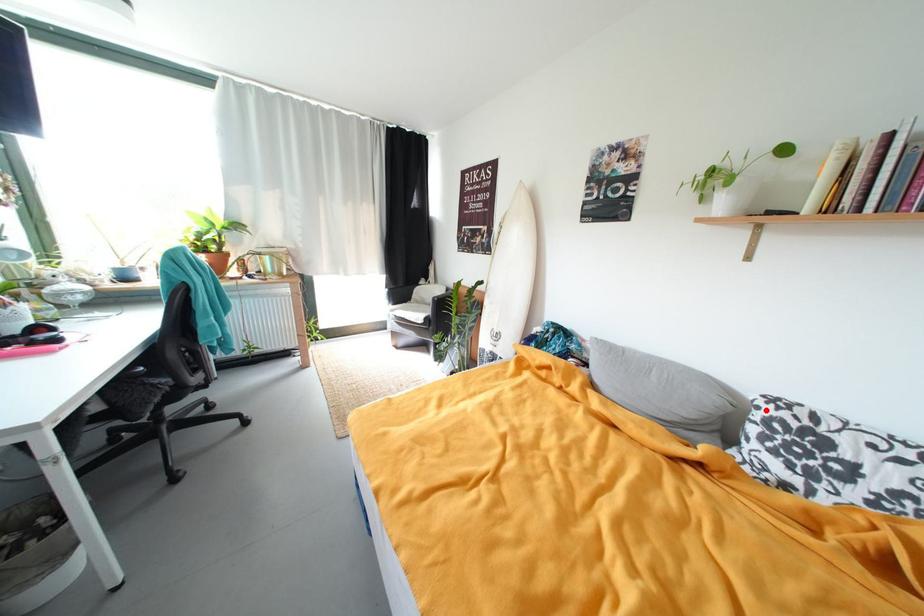
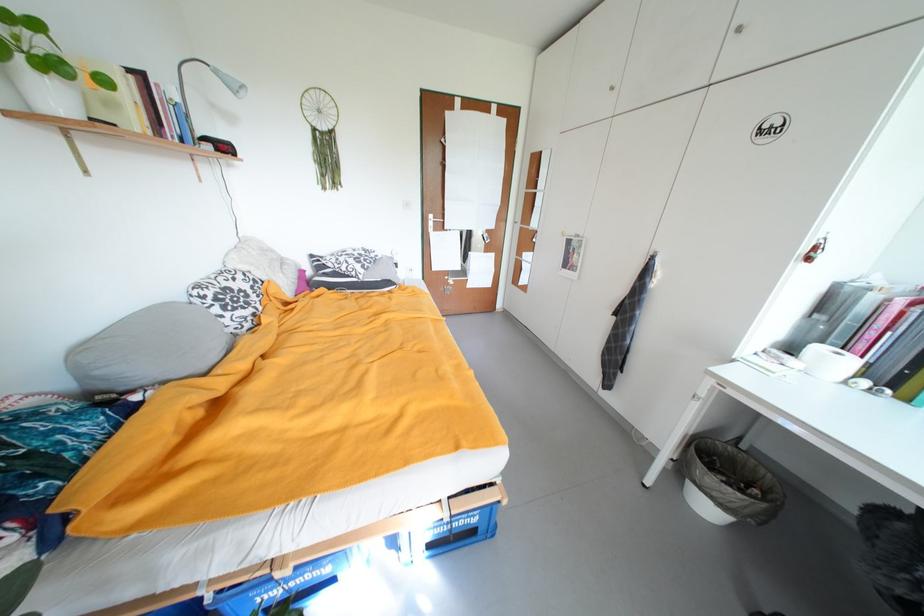
Question: I am providing you with two images of the same scene from different viewpoints. Image1 has a red point marked. In image2, the corresponding 3D location appears at what relative position? Reply with the corresponding letter.

Choices:
 (A) Closer
 (B) Farther

Answer: (A)